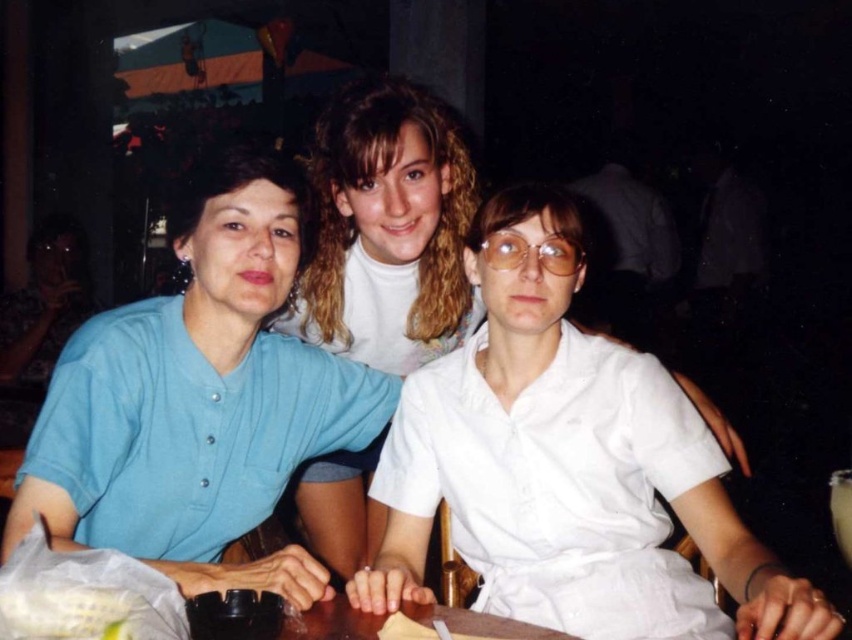
Based on the photo, can you confirm if matte blue shirt at left is wider than white matte shirt at center?

Correct, the width of matte blue shirt at left exceeds that of white matte shirt at center.

Is matte blue shirt at left thinner than white matte shirt at center?

No.

The image size is (852, 640). Describe the element at coordinates (199, 400) in the screenshot. I see `matte blue shirt at left` at that location.

Locate an element on the screen. This screenshot has width=852, height=640. matte blue shirt at left is located at coordinates (199, 400).